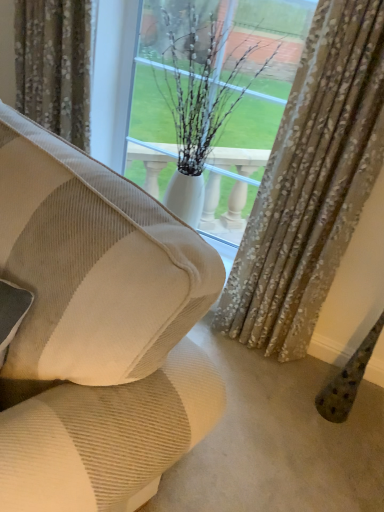
Question: Would you say patterned fabric curtain at upper center, marked as the 2th curtain in a right-to-left arrangement, is to the left or to the right of white glossy vase at center in the picture?

Choices:
 (A) right
 (B) left

Answer: (B)

Question: From a real-world perspective, is patterned fabric curtain at upper center, placed as the 1th curtain when sorted from left to right, above or below white glossy vase at center?

Choices:
 (A) above
 (B) below

Answer: (A)

Question: Based on their relative distances, which object is farther from the white glossy vase at center?

Choices:
 (A) beige corduroy couch at center
 (B) patterned fabric curtain at upper center, marked as the 2th curtain in a right-to-left arrangement
 (C) textured beige curtain at center, the 2th curtain from the left

Answer: (A)

Question: Which is nearer to the white glossy vase at center?

Choices:
 (A) textured beige curtain at center, the first curtain from the right
 (B) patterned fabric curtain at upper center, marked as the 2th curtain in a right-to-left arrangement
 (C) beige corduroy couch at center

Answer: (A)